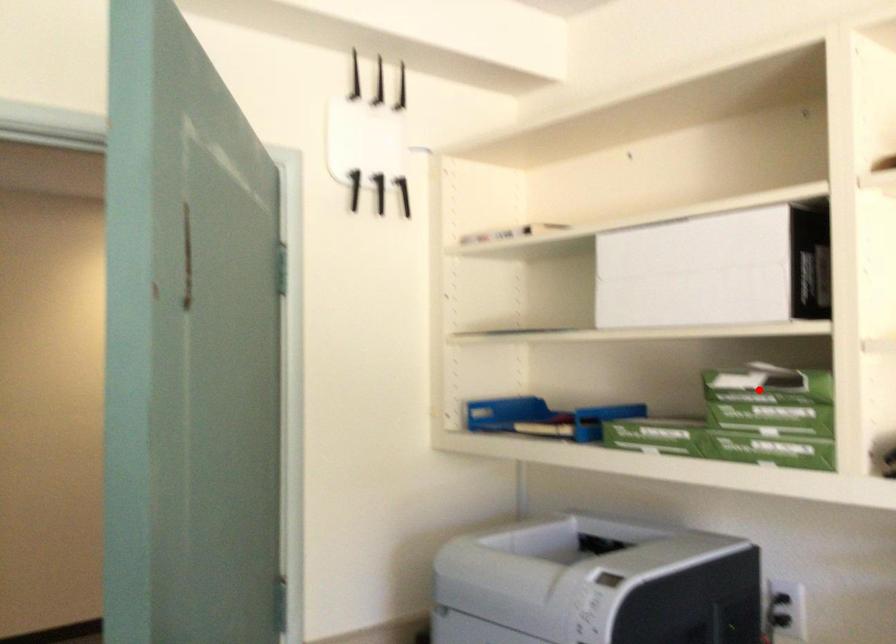
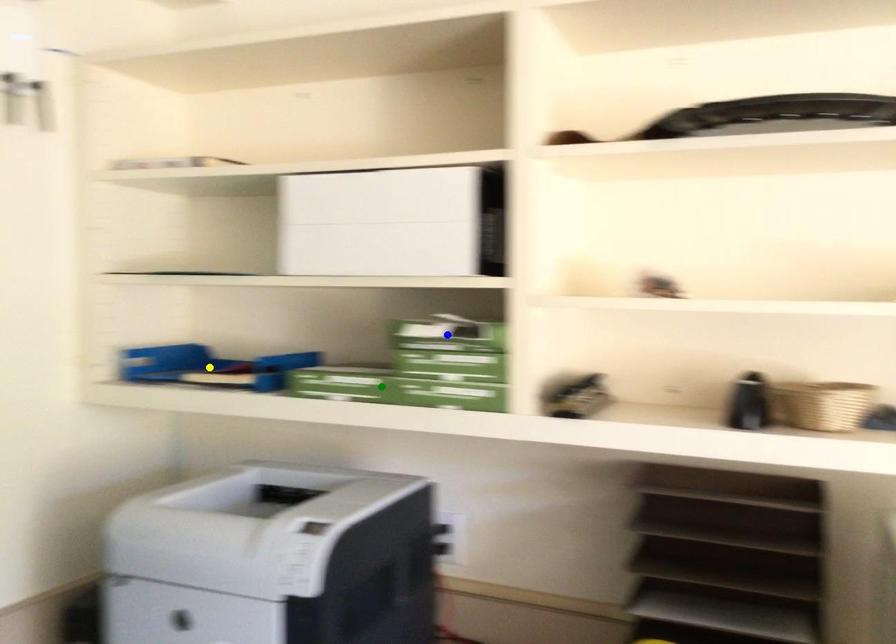
Question: I am providing you with two images of the same scene from different viewpoints. A red point is marked on the first image. You are given multiple points on the second image. Which point in image 2 represents the same 3d spot as the red point in image 1?

Choices:
 (A) blue point
 (B) green point
 (C) yellow point

Answer: (A)